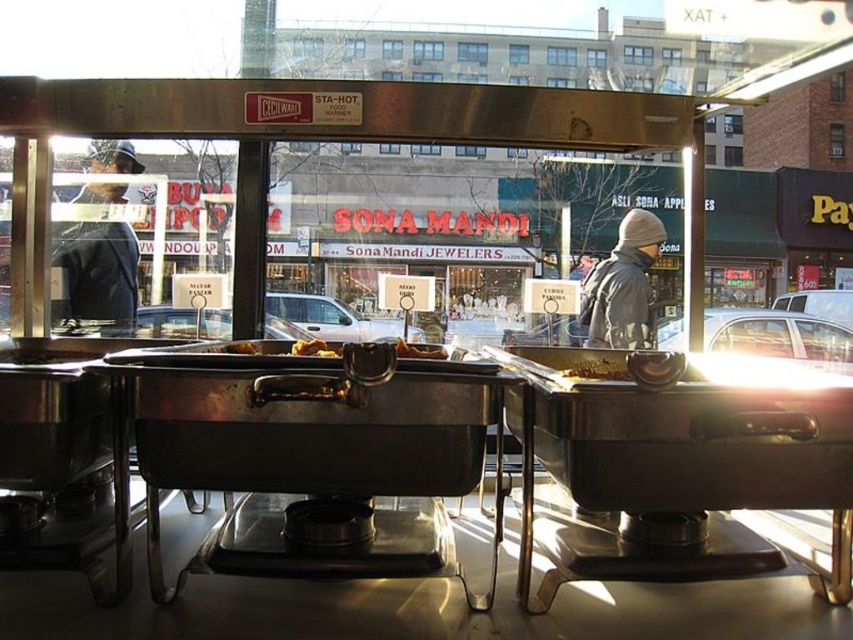
You are a customer standing at the entrance of the food establishment. You see the dark blue jacket at left and the yellow matte food at center. How far apart are these two items from each other?

The dark blue jacket at left and the yellow matte food at center are 6.94 feet apart from each other.

You are a customer at this food establishment and want to choose between the brown matte food at center and the slightly browned bread at center. Based on their height, which one is taller?

The brown matte food at center is much taller than the slightly browned bread at center.